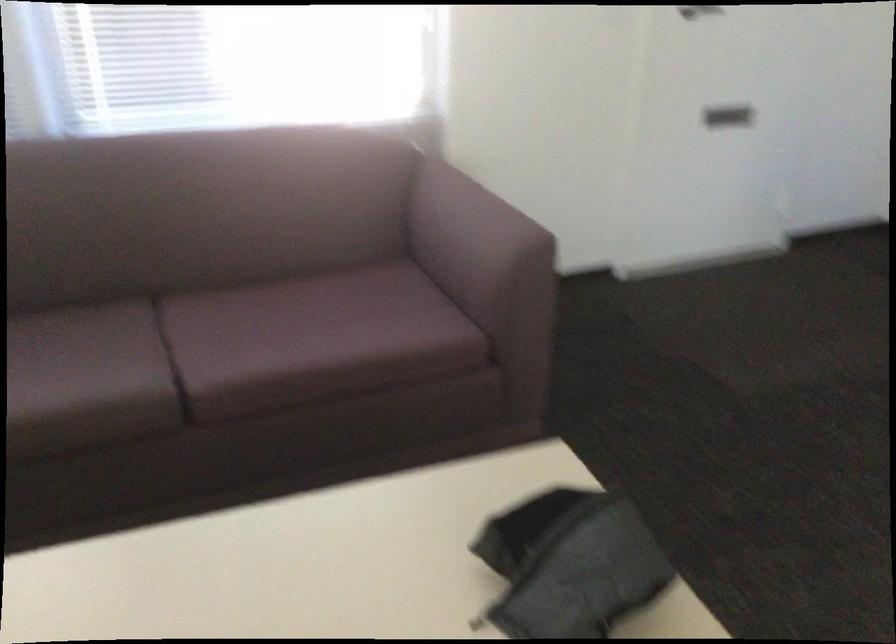
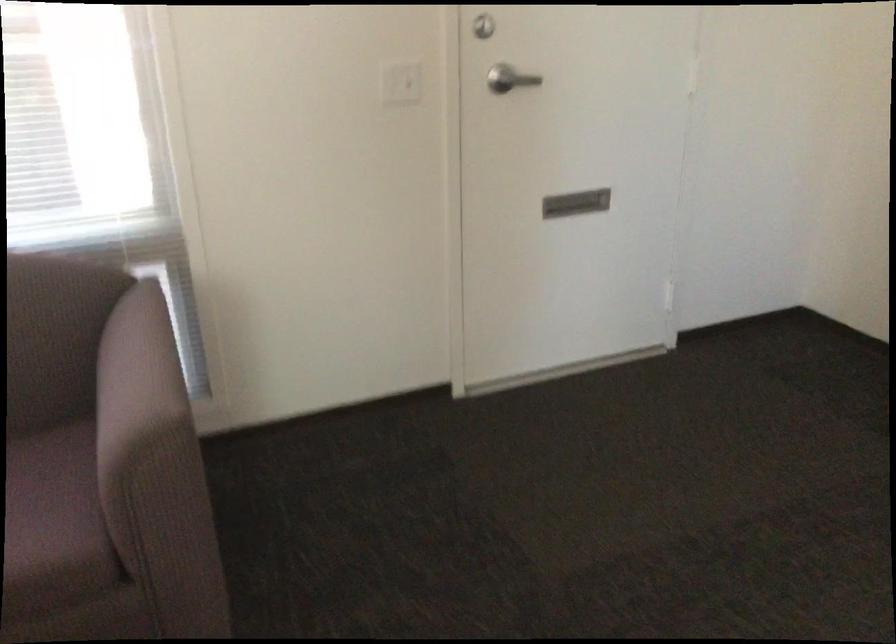
Question: How did the camera likely rotate?

Choices:
 (A) Left
 (B) Right
 (C) Up
 (D) Down

Answer: (C)